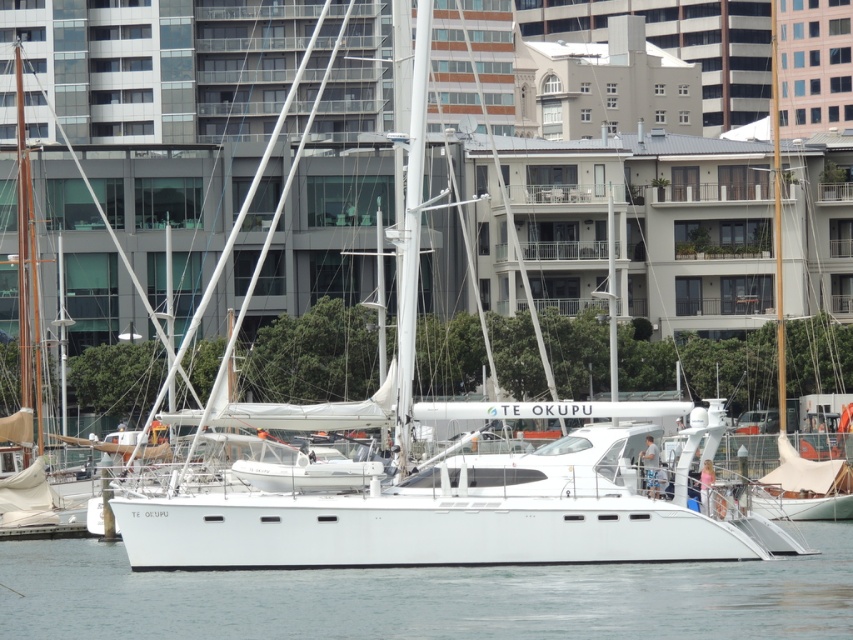
Question: Which point is farther to the camera?

Choices:
 (A) white matte sailboat at right
 (B) white smooth water at center

Answer: (A)

Question: From the image, what is the correct spatial relationship of white smooth water at center in relation to white matte sailboat at right?

Choices:
 (A) right
 (B) left

Answer: (B)

Question: Can you confirm if white smooth water at center is thinner than white matte sailboat at right?

Choices:
 (A) no
 (B) yes

Answer: (B)

Question: Is white smooth water at center in front of white matte sailboat at right?

Choices:
 (A) yes
 (B) no

Answer: (A)

Question: Which point is farther to the camera?

Choices:
 (A) white matte sailboat at right
 (B) white smooth water at center

Answer: (A)